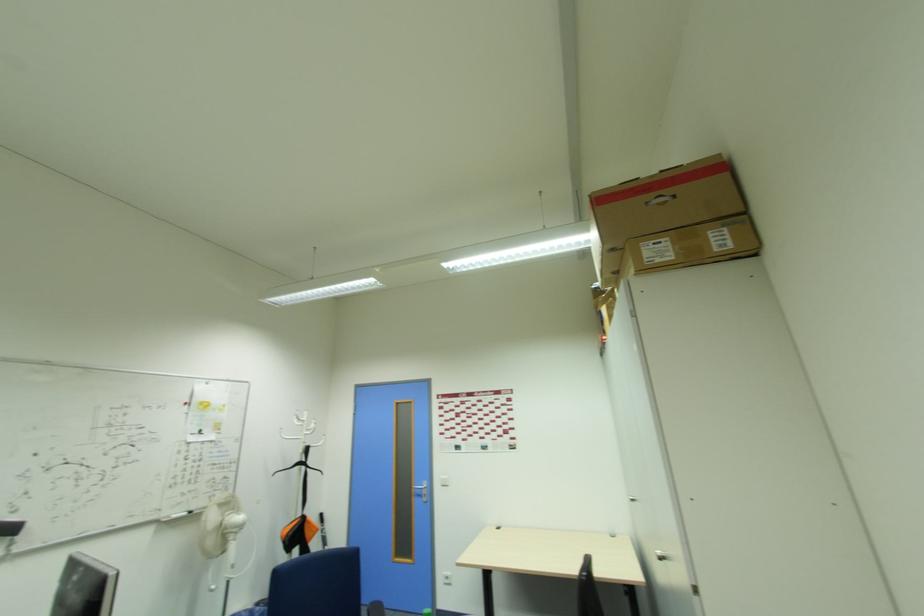
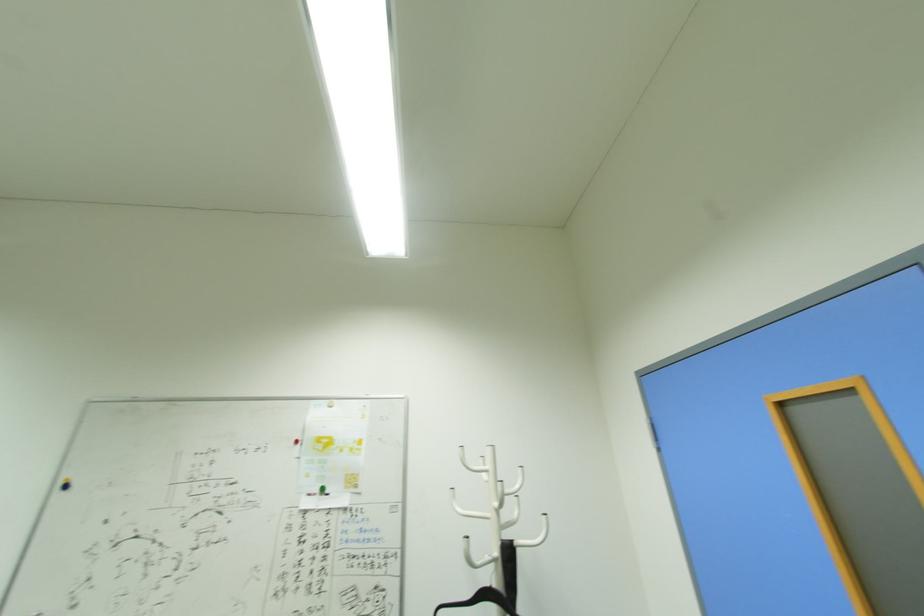
The point at (x=314, y=447) is marked in the first image. Where is the corresponding point in the second image?

(518, 544)